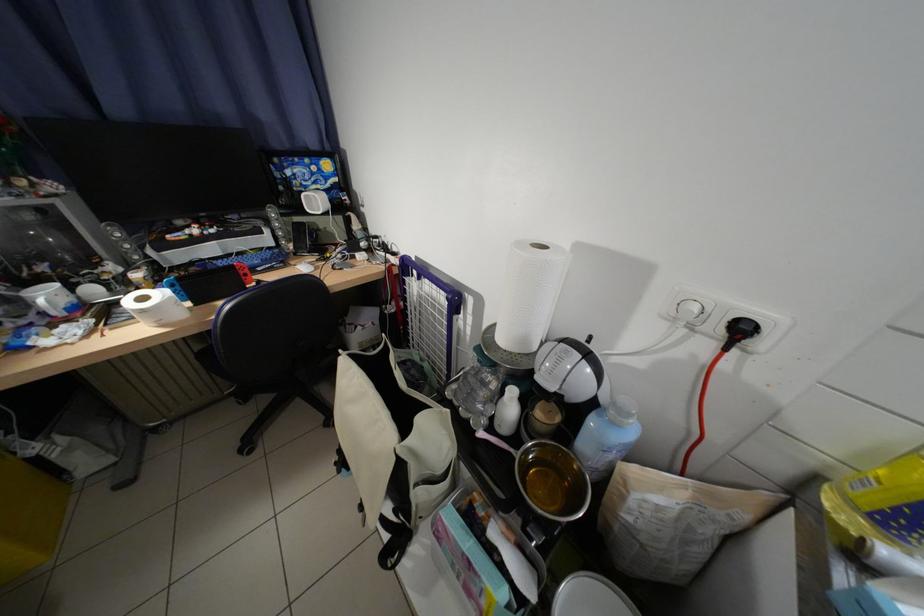
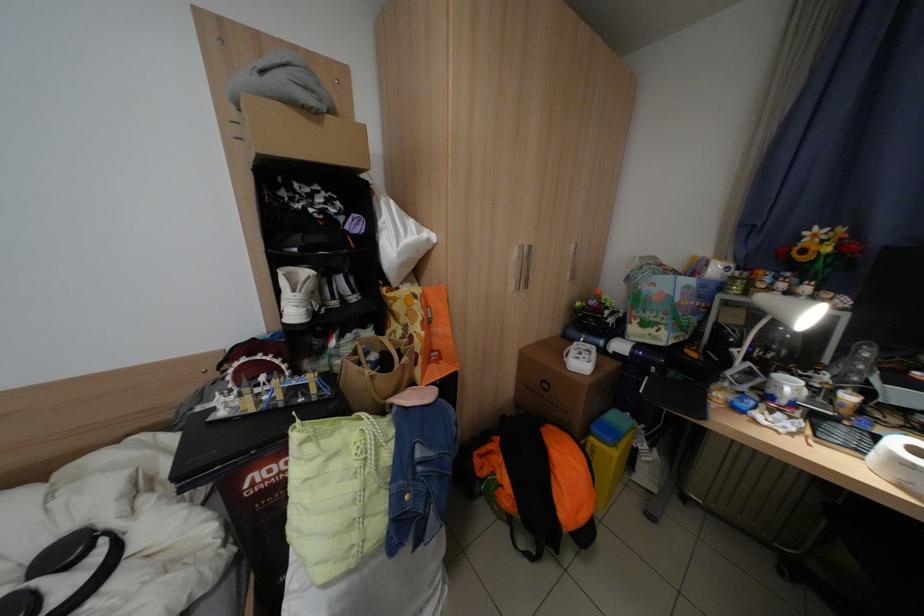
In the second image, find the point that corresponds to [59,297] in the first image.

(800, 387)